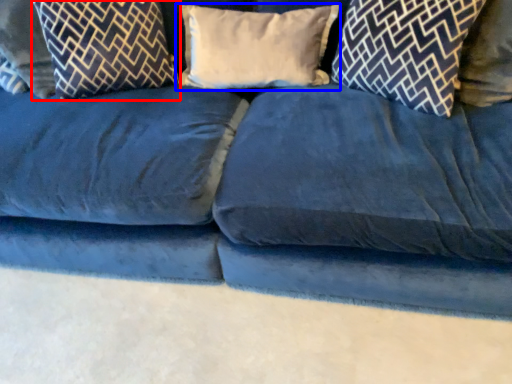
Question: Which of the following is the closest to the observer, pillow (highlighted by a red box) or pillow (highlighted by a blue box)?

Choices:
 (A) pillow
 (B) pillow

Answer: (A)